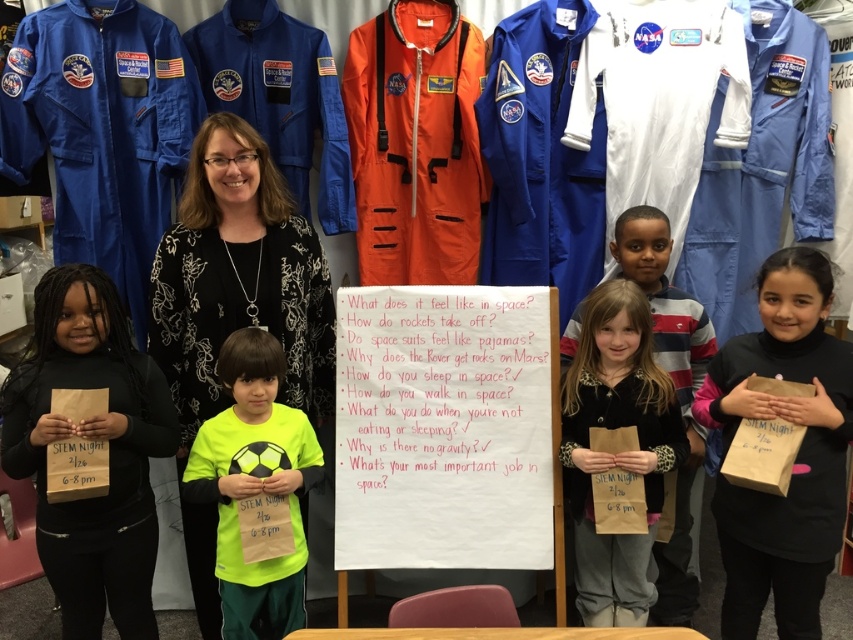
Is point (831, 340) closer to camera compared to point (614, 248)?

That is True.

Is brown paper bag at lower right thinner than matte brown paper bag at center?

Yes, brown paper bag at lower right is thinner than matte brown paper bag at center.

At what (x,y) coordinates should I click in order to perform the action: click on brown paper bag at lower right. Please return your answer as a coordinate pair (x, y). Looking at the image, I should click on pyautogui.click(x=795, y=456).

The height and width of the screenshot is (640, 853). Identify the location of brown paper bag at lower left. (91, 436).

Measure the distance between brown paper bag at lower left and camera.

A distance of 1.91 meters exists between brown paper bag at lower left and camera.

Measure the distance between brown paper bag at lower left and camera.

A distance of 1.91 meters exists between brown paper bag at lower left and camera.

Where is `brown paper bag at lower left`? The height and width of the screenshot is (640, 853). brown paper bag at lower left is located at coordinates (91, 436).

Is black satin blouse at center wider than neon green t-shirt at center?

Yes, black satin blouse at center is wider than neon green t-shirt at center.

What do you see at coordinates (234, 307) in the screenshot? I see `black satin blouse at center` at bounding box center [234, 307].

Is point (292, 250) positioned behind point (242, 378)?

Yes, point (292, 250) is behind point (242, 378).

I want to click on black satin blouse at center, so click(234, 307).